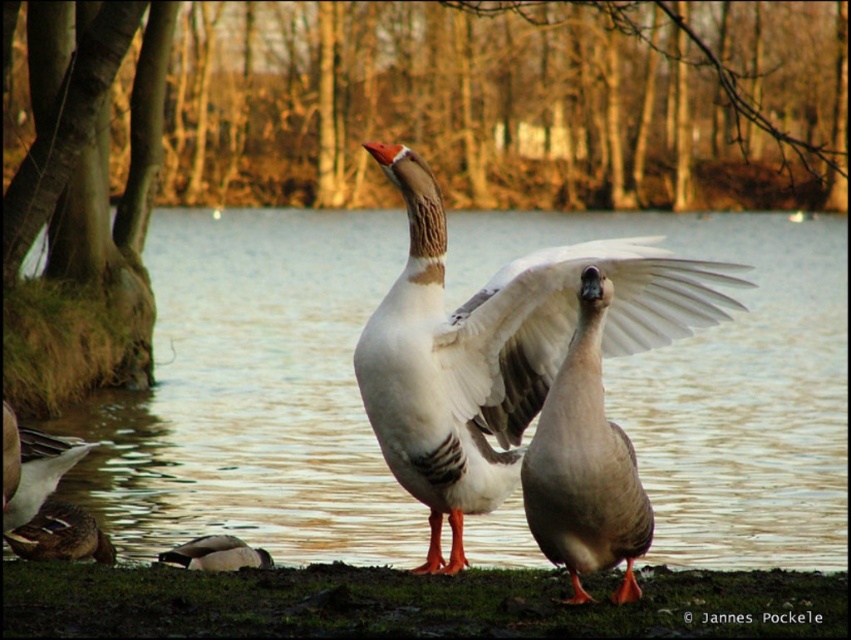
Looking at this image, you are a birdwatcher trying to identify ducks in the image. You notice the matte gray duck at center and the brown fuzzy duck at lower left. Which duck is bigger in size?

The matte gray duck at center is larger in size than the brown fuzzy duck at lower left.

You are a photographer trying to capture the white feathered goose at center and the brown matte duck at lower left in a single frame. Based on their positions, which one is closer to the left side of the image?

The brown matte duck at lower left is closer to the left side of the image since it is positioned to the left of the white feathered goose at center.

You are standing at the edge of the lake and want to place a small marker at both point (578, 442) and point (30, 556). Which point is closer to you?

Point (578, 442) is closer to the viewer than point (30, 556).